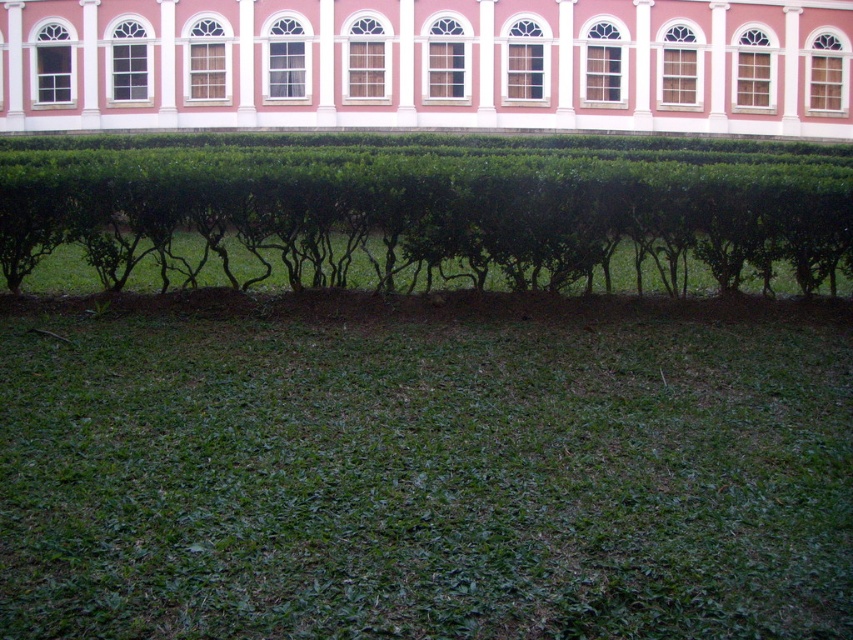
Looking at this image, is green grass at lower center closer to camera compared to green leafy bush at center?

Yes, green grass at lower center is in front of green leafy bush at center.

Describe the element at coordinates (424, 480) in the screenshot. The height and width of the screenshot is (640, 853). I see `green grass at lower center` at that location.

Between point (601, 385) and point (71, 202), which one is positioned behind?

Positioned behind is point (71, 202).

Image resolution: width=853 pixels, height=640 pixels. I want to click on green grass at lower center, so pyautogui.click(x=424, y=480).

Which is below, green grass at lower center or pink smooth wall at upper center?

green grass at lower center is below.

Is point (714, 577) farther from camera compared to point (833, 92)?

No, it is not.

Who is more distant from viewer, (636, 557) or (115, 3)?

Point (115, 3)

Where is `green grass at lower center`? This screenshot has height=640, width=853. green grass at lower center is located at coordinates (424, 480).

Is point (78, 234) behind point (190, 49)?

That is False.

Between green leafy bush at center and pink smooth wall at upper center, which one has less height?

pink smooth wall at upper center is shorter.

Is point (155, 141) positioned after point (631, 20)?

No.

You are a GUI agent. You are given a task and a screenshot of the screen. Output one action in this format:
    pyautogui.click(x=<x>, y=<y>)
    Task: Click on the green leafy bush at center
    
    Given the screenshot: What is the action you would take?
    pyautogui.click(x=428, y=209)